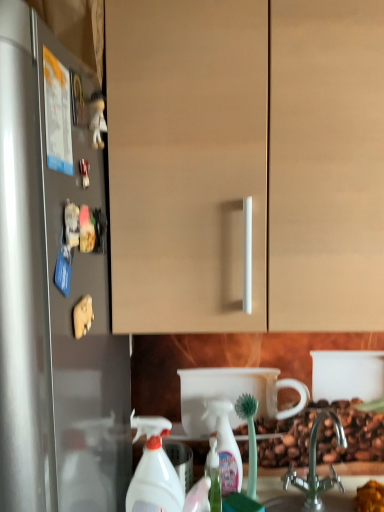
Question: Is translucent plastic soap dispenser at lower center touching silver metallic faucet at lower center?

Choices:
 (A) no
 (B) yes

Answer: (A)

Question: From a real-world perspective, is translucent plastic soap dispenser at lower center below silver metallic faucet at lower center?

Choices:
 (A) yes
 (B) no

Answer: (A)

Question: From the image's perspective, would you say translucent plastic soap dispenser at lower center is positioned over silver metallic faucet at lower center?

Choices:
 (A) yes
 (B) no

Answer: (B)

Question: Considering the relative sizes of translucent plastic soap dispenser at lower center and silver metallic faucet at lower center in the image provided, is translucent plastic soap dispenser at lower center thinner than silver metallic faucet at lower center?

Choices:
 (A) no
 (B) yes

Answer: (B)

Question: Considering the relative positions of translucent plastic soap dispenser at lower center and silver metallic faucet at lower center in the image provided, is translucent plastic soap dispenser at lower center to the right of silver metallic faucet at lower center from the viewer's perspective?

Choices:
 (A) no
 (B) yes

Answer: (A)

Question: From the image's perspective, is translucent plastic soap dispenser at lower center above or below white plastic spray bottle at lower center, which appears as the first cleaning product when viewed from the right?

Choices:
 (A) below
 (B) above

Answer: (A)

Question: In terms of width, does translucent plastic soap dispenser at lower center look wider or thinner when compared to white plastic spray bottle at lower center, which is the 2th cleaning product in left-to-right order?

Choices:
 (A) thin
 (B) wide

Answer: (B)

Question: Do you think translucent plastic soap dispenser at lower center is within white plastic spray bottle at lower center, the 2th cleaning product positioned from the front, or outside of it?

Choices:
 (A) inside
 (B) outside

Answer: (B)

Question: Would you say translucent plastic soap dispenser at lower center is to the left or to the right of white plastic spray bottle at lower center, which is the 2th cleaning product in left-to-right order, in the picture?

Choices:
 (A) right
 (B) left

Answer: (B)

Question: Is silver metallic faucet at lower center to the left or to the right of white plastic spray bottle at lower center, the 2th cleaning product positioned from the front, in the image?

Choices:
 (A) right
 (B) left

Answer: (A)

Question: Is silver metallic faucet at lower center wider or thinner than white plastic spray bottle at lower center, which is the first cleaning product from back to front?

Choices:
 (A) wide
 (B) thin

Answer: (A)

Question: In terms of height, does silver metallic faucet at lower center look taller or shorter compared to white plastic spray bottle at lower center, which is the 2th cleaning product in left-to-right order?

Choices:
 (A) tall
 (B) short

Answer: (B)

Question: Is point (316, 415) closer or farther from the camera than point (236, 484)?

Choices:
 (A) farther
 (B) closer

Answer: (A)

Question: Considering their positions, is silver metallic faucet at lower center located in front of or behind white plastic spray bottle at lower center, the 1th cleaning product viewed from the left?

Choices:
 (A) front
 (B) behind

Answer: (B)

Question: From a real-world perspective, is silver metallic faucet at lower center positioned above or below white plastic spray bottle at lower center, the 1th cleaning product viewed from the left?

Choices:
 (A) above
 (B) below

Answer: (B)